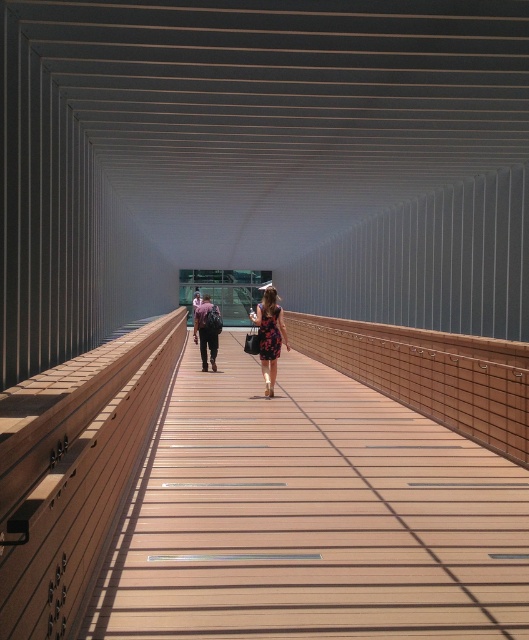
Between floral dress at center and matte black backpack at center, which one has more height?

With more height is floral dress at center.

Does floral dress at center appear over matte black backpack at center?

Correct, floral dress at center is located above matte black backpack at center.

Identify the location of floral dress at center. (269, 336).

Does brown wooden bridge at center lie in front of floral dress at center?

Yes, it is in front of floral dress at center.

Who is taller, brown wooden bridge at center or floral dress at center?

floral dress at center

Is point (196, 605) positioned after point (257, 307)?

No, (196, 605) is closer to viewer.

Find the location of a particular element. This screenshot has width=529, height=640. brown wooden bridge at center is located at coordinates (312, 516).

What do you see at coordinates (312, 516) in the screenshot? The height and width of the screenshot is (640, 529). I see `brown wooden bridge at center` at bounding box center [312, 516].

Can you confirm if brown wooden bridge at center is positioned to the right of floral-patterned fabric dress at center?

Indeed, brown wooden bridge at center is positioned on the right side of floral-patterned fabric dress at center.

Does point (495, 538) come closer to viewer compared to point (278, 333)?

That is True.

Locate an element on the screen. The height and width of the screenshot is (640, 529). brown wooden bridge at center is located at coordinates (312, 516).